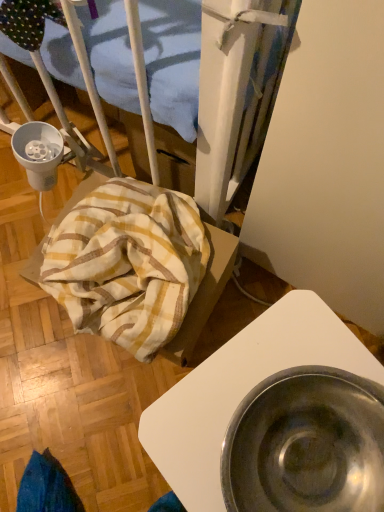
Question: Does metallic silver bowl at lower right have a lesser width compared to yellow-white striped fabric at lower left?

Choices:
 (A) no
 (B) yes

Answer: (A)

Question: Does metallic silver bowl at lower right turn towards yellow-white striped fabric at lower left?

Choices:
 (A) no
 (B) yes

Answer: (A)

Question: Considering the relative sizes of metallic silver bowl at lower right and yellow-white striped fabric at lower left in the image provided, is metallic silver bowl at lower right bigger than yellow-white striped fabric at lower left?

Choices:
 (A) yes
 (B) no

Answer: (A)

Question: Is metallic silver bowl at lower right smaller than yellow-white striped fabric at lower left?

Choices:
 (A) yes
 (B) no

Answer: (B)

Question: Is metallic silver bowl at lower right located outside yellow-white striped fabric at lower left?

Choices:
 (A) no
 (B) yes

Answer: (B)

Question: Is metallic silver bowl at lower right to the left of yellow-white striped fabric at lower left from the viewer's perspective?

Choices:
 (A) yes
 (B) no

Answer: (B)

Question: Would you say yellow-white striped fabric at lower left is a long distance from metallic silver bowl at lower right?

Choices:
 (A) yes
 (B) no

Answer: (B)

Question: Does yellow-white striped fabric at lower left have a greater height compared to metallic silver bowl at lower right?

Choices:
 (A) yes
 (B) no

Answer: (B)

Question: From a real-world perspective, is yellow-white striped fabric at lower left beneath metallic silver bowl at lower right?

Choices:
 (A) yes
 (B) no

Answer: (A)

Question: From the image's perspective, does yellow-white striped fabric at lower left appear lower than metallic silver bowl at lower right?

Choices:
 (A) yes
 (B) no

Answer: (B)

Question: Is yellow-white striped fabric at lower left not inside metallic silver bowl at lower right?

Choices:
 (A) no
 (B) yes

Answer: (B)

Question: From the image's perspective, is yellow-white striped fabric at lower left above metallic silver bowl at lower right?

Choices:
 (A) yes
 (B) no

Answer: (A)

Question: Considering the positions of metallic silver bowl at lower right and yellow-white striped fabric at lower left in the image, is metallic silver bowl at lower right taller or shorter than yellow-white striped fabric at lower left?

Choices:
 (A) short
 (B) tall

Answer: (B)